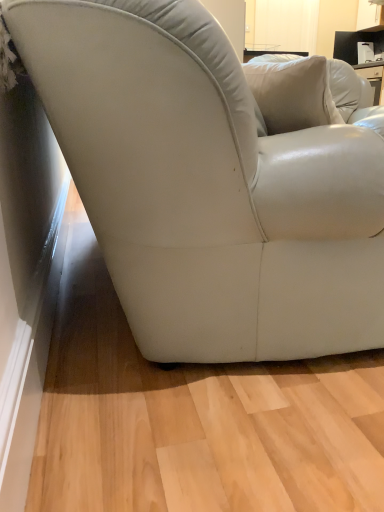
This screenshot has height=512, width=384. Describe the element at coordinates (207, 187) in the screenshot. I see `matte leather couch at center` at that location.

You are a GUI agent. You are given a task and a screenshot of the screen. Output one action in this format:
    pyautogui.click(x=<x>, y=<y>)
    Task: Click on the matte leather couch at center
    Image resolution: width=384 pixels, height=512 pixels.
    Given the screenshot: What is the action you would take?
    pos(207,187)

Looking at this image, measure the distance between matte leather couch at center and camera.

matte leather couch at center is 23.71 inches from camera.

The height and width of the screenshot is (512, 384). Find the location of `matte leather couch at center`. matte leather couch at center is located at coordinates (207, 187).